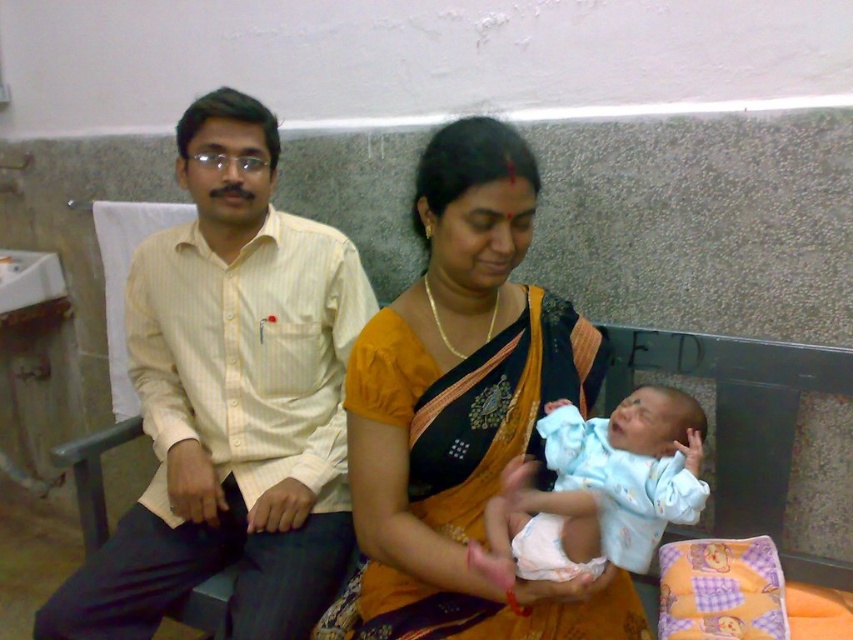
Question: Can you confirm if matte yellow sari at center is positioned to the right of light blue fabric baby at center?

Choices:
 (A) yes
 (B) no

Answer: (B)

Question: Which point is farther to the camera?

Choices:
 (A) (633, 531)
 (B) (419, 445)

Answer: (B)

Question: Among these points, which one is farthest from the camera?

Choices:
 (A) click(511, 502)
 (B) click(260, 534)

Answer: (B)

Question: Which point is closer to the camera taking this photo?

Choices:
 (A) (509, 173)
 (B) (642, 442)

Answer: (A)

Question: Does yellow striped shirt at left appear under light blue fabric baby at center?

Choices:
 (A) yes
 (B) no

Answer: (B)

Question: Is yellow striped shirt at left smaller than light blue fabric baby at center?

Choices:
 (A) yes
 (B) no

Answer: (B)